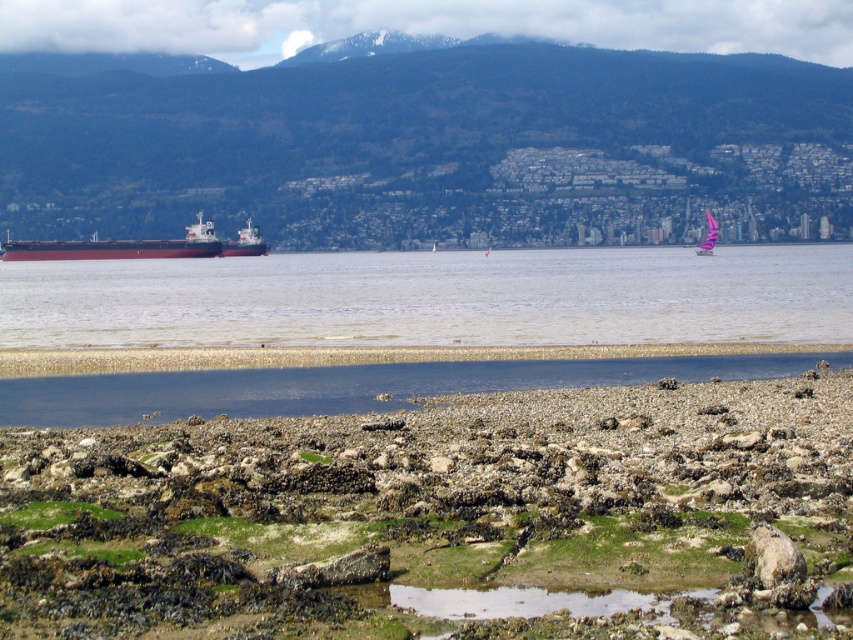
Question: Estimate the real-world distances between objects in this image. Which object is farther from the green forested mountain at upper center?

Choices:
 (A) smooth water at center
 (B) pink fabric sailboat at center

Answer: (A)

Question: Which object is the farthest from the smooth water at center?

Choices:
 (A) green forested mountain at upper center
 (B) pink fabric sailboat at center

Answer: (A)

Question: Does smooth water at center lie behind red matte cargo ship at left?

Choices:
 (A) no
 (B) yes

Answer: (A)

Question: Is red matte cargo ship at left wider than pink fabric sailboat at center?

Choices:
 (A) yes
 (B) no

Answer: (A)

Question: Considering the real-world distances, which object is farthest from the smooth water at center?

Choices:
 (A) pink fabric sailboat at center
 (B) red matte cargo ship at left
 (C) green forested mountain at upper center

Answer: (C)

Question: Is green forested mountain at upper center positioned before pink fabric sailboat at center?

Choices:
 (A) yes
 (B) no

Answer: (B)